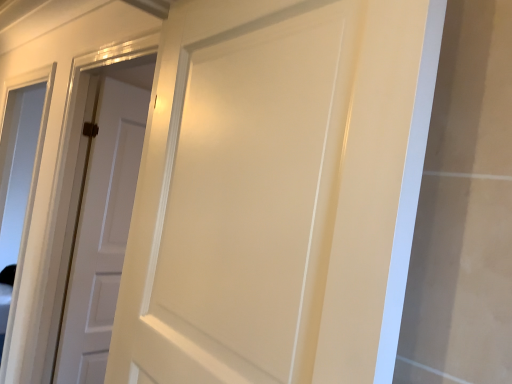
Question: From the image's perspective, relative to white matte door at center, the second door when ordered from front to back, is transparent glass window at left above or below?

Choices:
 (A) below
 (B) above

Answer: (A)

Question: Considering their positions, is transparent glass window at left located in front of or behind white matte door at center, which is the 1th door from back to front?

Choices:
 (A) behind
 (B) front

Answer: (A)

Question: Which is farther from the transparent glass window at left?

Choices:
 (A) white matte door at center, the second door when ordered from front to back
 (B) matte white door at center, positioned as the 2th door in back-to-front order

Answer: (B)

Question: Which object is positioned closest to the matte white door at center, acting as the first door starting from the front?

Choices:
 (A) white matte door at center, which is the 1th door from back to front
 (B) transparent glass window at left

Answer: (A)